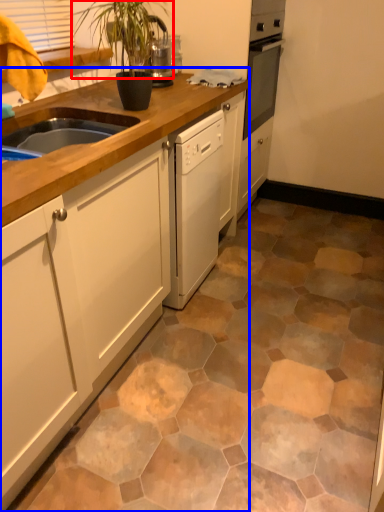
Question: Which object is further to the camera taking this photo, plant (highlighted by a red box) or cabinetry (highlighted by a blue box)?

Choices:
 (A) plant
 (B) cabinetry

Answer: (A)